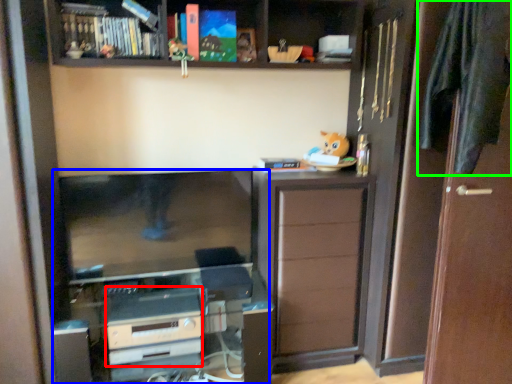
Question: Which is farther away from appliance (highlighted by a red box)? entertainment center (highlighted by a blue box) or clothe (highlighted by a green box)?

Choices:
 (A) entertainment center
 (B) clothe

Answer: (B)